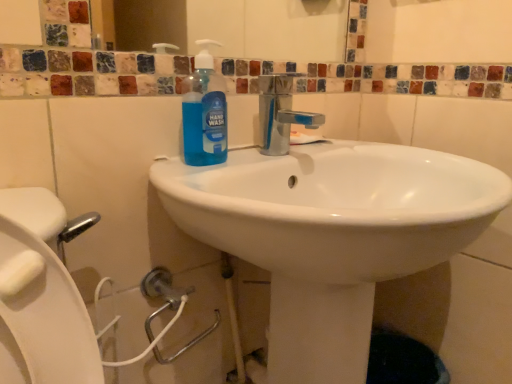
The image size is (512, 384). In order to click on blue translucent hand wash at center in this screenshot , I will do `click(204, 112)`.

What do you see at coordinates (204, 112) in the screenshot? I see `blue translucent hand wash at center` at bounding box center [204, 112].

This screenshot has height=384, width=512. Describe the element at coordinates (330, 229) in the screenshot. I see `white glossy sink at center` at that location.

Find the location of a particular element. The image size is (512, 384). white glossy sink at center is located at coordinates (330, 229).

Measure the distance between point (189,180) and camera.

A distance of 25.16 inches exists between point (189,180) and camera.

Locate an element on the screen. blue translucent hand wash at center is located at coordinates (204, 112).

Based on the photo, considering the positions of objects white glossy sink at center and blue translucent hand wash at center in the image provided, who is more to the left, white glossy sink at center or blue translucent hand wash at center?

Positioned to the left is blue translucent hand wash at center.

In the scene shown: Is the position of white glossy sink at center less distant than that of blue translucent hand wash at center?

Yes, it is in front of blue translucent hand wash at center.

Considering the points (413, 229) and (189, 90), which point is behind, point (413, 229) or point (189, 90)?

The point (189, 90) is farther.

Consider the image. From the image's perspective, would you say white glossy sink at center is positioned over blue translucent hand wash at center?

Incorrect, from the image's perspective, white glossy sink at center is lower than blue translucent hand wash at center.

From a real-world perspective, is white glossy sink at center below blue translucent hand wash at center?

Indeed, from a real-world perspective, white glossy sink at center is positioned beneath blue translucent hand wash at center.

Which object is thinner, white glossy sink at center or blue translucent hand wash at center?

Thinner between the two is blue translucent hand wash at center.

Considering the relative sizes of white glossy sink at center and blue translucent hand wash at center in the image provided, is white glossy sink at center shorter than blue translucent hand wash at center?

In fact, white glossy sink at center may be taller than blue translucent hand wash at center.

Between white glossy sink at center and blue translucent hand wash at center, which one has smaller size?

Smaller between the two is blue translucent hand wash at center.

Which is correct: white glossy sink at center is inside blue translucent hand wash at center, or outside of it?

white glossy sink at center lies outside blue translucent hand wash at center.

Is white glossy sink at center positioned far away from blue translucent hand wash at center?

That's not correct — white glossy sink at center is a little close to blue translucent hand wash at center.

Is blue translucent hand wash at center at the back of white glossy sink at center?

That's right, white glossy sink at center is facing away from blue translucent hand wash at center.

You are a GUI agent. You are given a task and a screenshot of the screen. Output one action in this format:
    pyautogui.click(x=<x>, y=<y>)
    Task: Click on the cleaning product behind the white glossy sink at center
    
    Given the screenshot: What is the action you would take?
    pyautogui.click(x=204, y=112)

Is blue translucent hand wash at center at the left side of white glossy sink at center?

Yes.

Is blue translucent hand wash at center positioned before white glossy sink at center?

No, blue translucent hand wash at center is behind white glossy sink at center.

Is point (209, 147) closer or farther from the camera than point (433, 158)?

Clearly, point (209, 147) is closer to the camera than point (433, 158).

From the image's perspective, is blue translucent hand wash at center located beneath white glossy sink at center?

No, from the image's perspective, blue translucent hand wash at center is not beneath white glossy sink at center.

From a real-world perspective, between blue translucent hand wash at center and white glossy sink at center, who is vertically lower?

In real-world perspective, white glossy sink at center is lower.

Considering the sizes of blue translucent hand wash at center and white glossy sink at center in the image, is blue translucent hand wash at center wider or thinner than white glossy sink at center?

In the image, blue translucent hand wash at center appears to be more narrow than white glossy sink at center.

Considering the sizes of objects blue translucent hand wash at center and white glossy sink at center in the image provided, who is taller, blue translucent hand wash at center or white glossy sink at center?

white glossy sink at center is taller.

Consider the image. Can you confirm if blue translucent hand wash at center is smaller than white glossy sink at center?

Yes.

Can white glossy sink at center be found inside blue translucent hand wash at center?

No, white glossy sink at center is not inside blue translucent hand wash at center.

Are blue translucent hand wash at center and white glossy sink at center located far from each other?

They are positioned close to each other.

Could you tell me if blue translucent hand wash at center is turned towards white glossy sink at center?

Yes, blue translucent hand wash at center is oriented towards white glossy sink at center.

Can you tell me how much blue translucent hand wash at center and white glossy sink at center differ in facing direction?

There is a 4.24-degree angle between the facing directions of blue translucent hand wash at center and white glossy sink at center.

How distant is blue translucent hand wash at center from white glossy sink at center?

blue translucent hand wash at center is 22.69 centimeters away from white glossy sink at center.

In order to click on cleaning product behind the white glossy sink at center in this screenshot , I will do `click(204, 112)`.

What are the coordinates of `sink in front of the blue translucent hand wash at center` in the screenshot? It's located at (330, 229).

Locate an element on the screen. sink lying on the right of blue translucent hand wash at center is located at coordinates (330, 229).